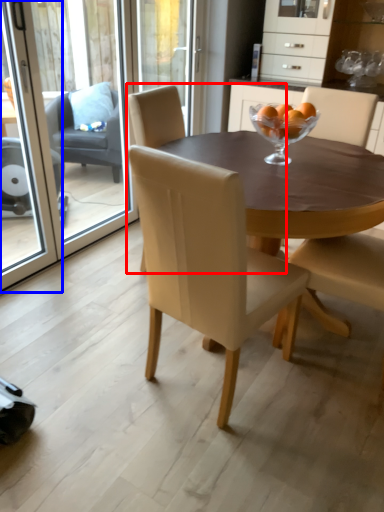
Question: Which point is further to the camera, chair (highlighted by a red box) or screen door (highlighted by a blue box)?

Choices:
 (A) chair
 (B) screen door

Answer: (A)